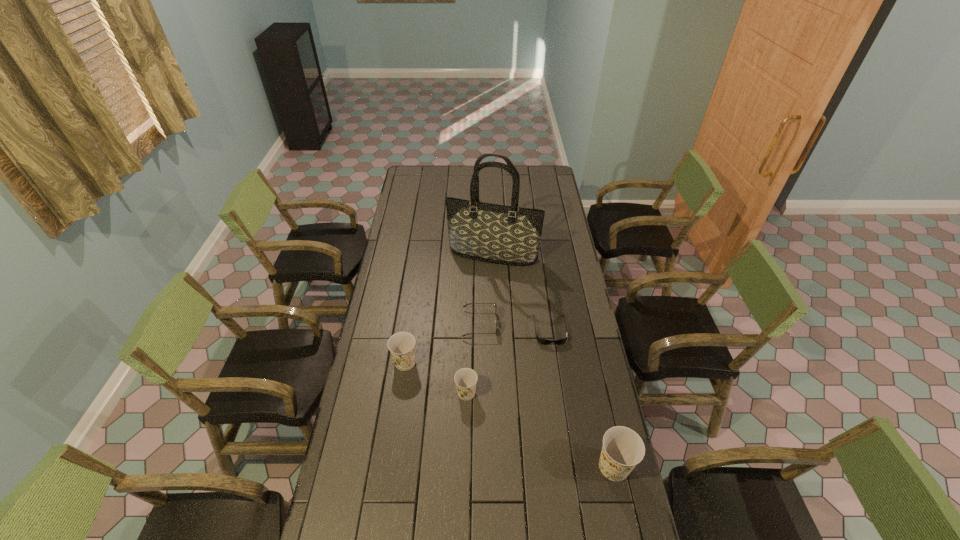
This screenshot has width=960, height=540. Identify the location of Dixie cup that is the nearest to the nearest Dixie cup. (465, 378).

Select which Dixie cup is the second closest to the second tallest Dixie cup. Please provide its 2D coordinates. Your answer should be formatted as a tuple, i.e. [(x, y)], where the tuple contains the x and y coordinates of a point satisfying the conditions above.

[(623, 448)]

You are a GUI agent. You are given a task and a screenshot of the screen. Output one action in this format:
    pyautogui.click(x=<x>, y=<y>)
    Task: Click on the vacant space that satisfies the following two spatial constraints: 1. on the lenses of the taller sunglasses; 2. on the back side of the nearest Dixie cup
    
    Given the screenshot: What is the action you would take?
    pyautogui.click(x=480, y=467)

At what (x,y) coordinates should I click in order to perform the action: click on vacant region that satisfies the following two spatial constraints: 1. on the lenses of the left sunglasses; 2. on the front side of the fourth tallest object. Please return your answer as a coordinate pair (x, y). This screenshot has height=540, width=960. Looking at the image, I should click on (480, 393).